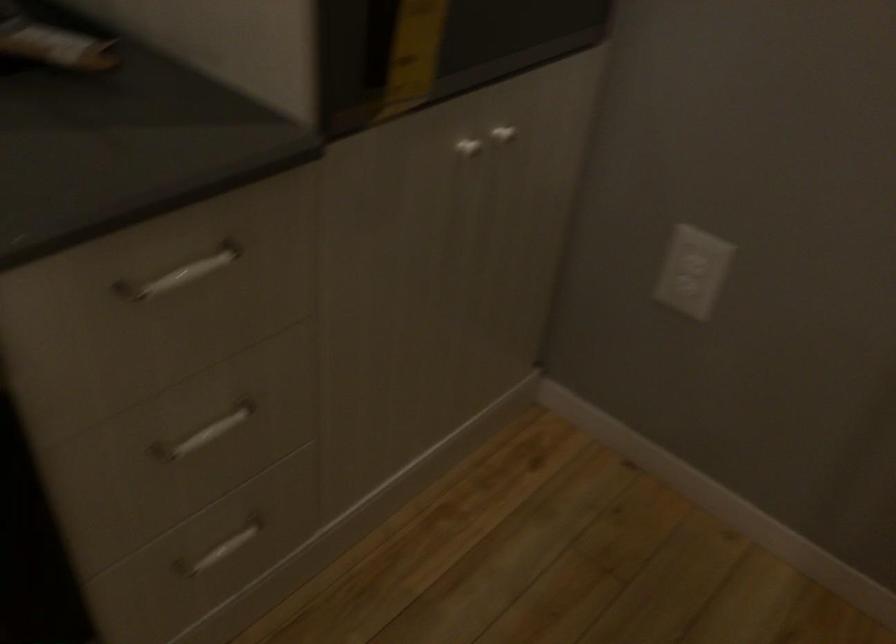
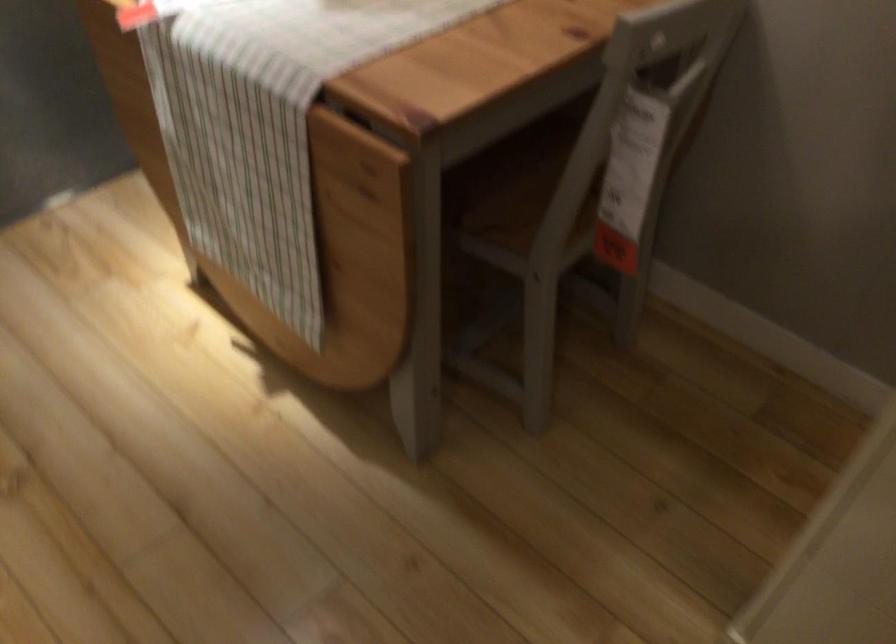
Based on the continuous images, in which direction is the camera rotating?

The camera's rotation is toward left-down.